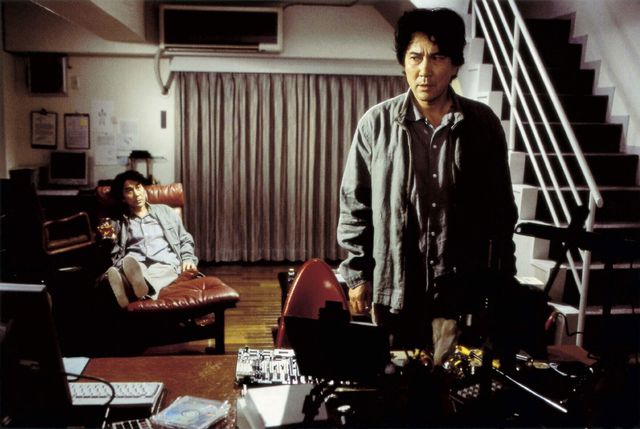
At what (x,y) coordinates should I click in order to perform the action: click on clutter. Please return your answer as a coordinate pair (x, y). Image resolution: width=640 pixels, height=429 pixels. Looking at the image, I should click on (486, 389).